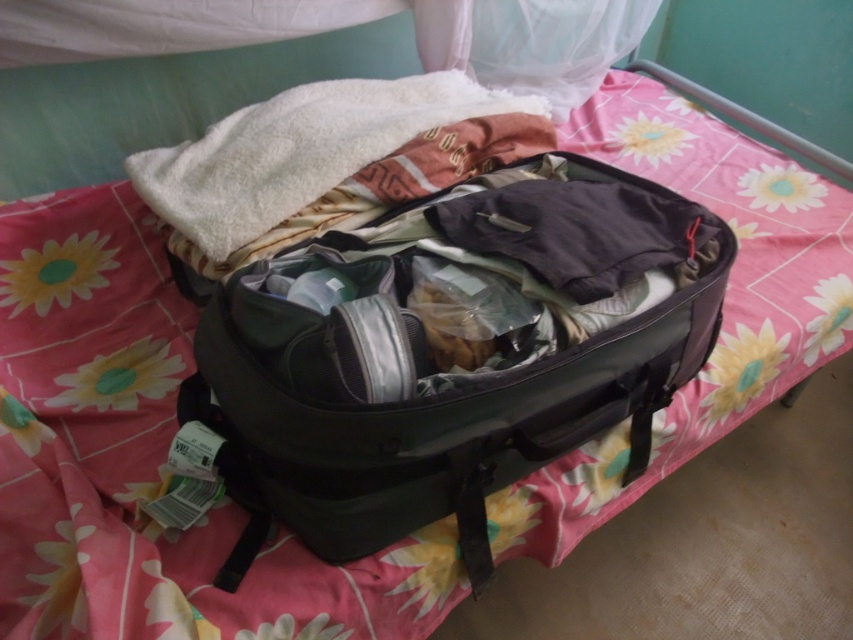
Question: Can you confirm if black fabric suitcase at center is positioned to the right of white fluffy towel at center?

Choices:
 (A) no
 (B) yes

Answer: (B)

Question: Can you confirm if black fabric suitcase at center is bigger than white fluffy towel at center?

Choices:
 (A) no
 (B) yes

Answer: (B)

Question: Among these points, which one is nearest to the camera?

Choices:
 (A) (289, 115)
 (B) (589, 385)

Answer: (B)

Question: Can you confirm if black fabric suitcase at center is thinner than white fluffy towel at center?

Choices:
 (A) no
 (B) yes

Answer: (A)